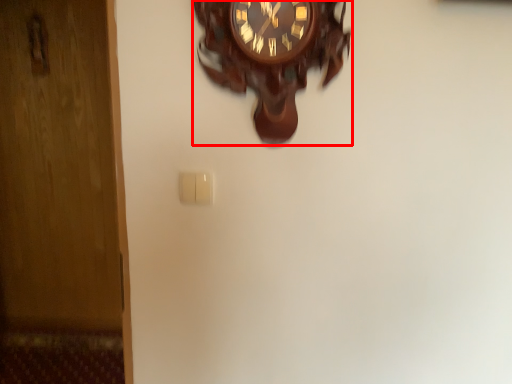
Question: From the image's perspective, considering the relative positions of wall clock (annotated by the red box) and light switch in the image provided, where is wall clock (annotated by the red box) located with respect to the staircase?

Choices:
 (A) below
 (B) above

Answer: (B)